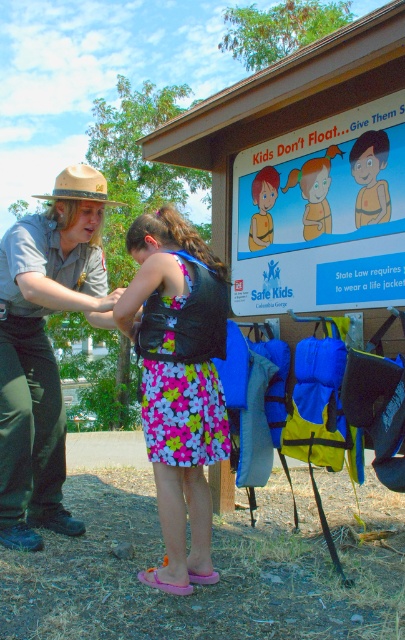
Which object takes up more space in the image, the matte yellow life jacket at center or the matte brown leather glove at upper left?

The matte brown leather glove at upper left occupies more space than the matte yellow life jacket at center.

Where is the floral fabric dress at center located in the image?

The floral fabric dress at center is located at point (179, 381).